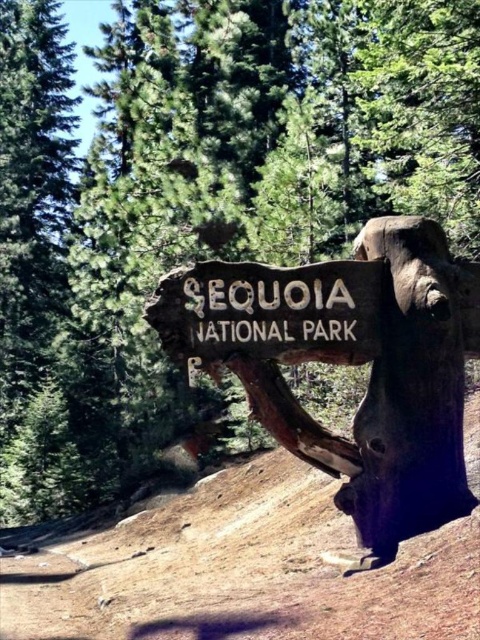
Question: Which object is farther from the camera taking this photo?

Choices:
 (A) weathered wood sign at center
 (B) brown dirt track at lower left

Answer: (A)

Question: Which point appears farthest from the camera in this image?

Choices:
 (A) (60, 620)
 (B) (276, 268)

Answer: (A)

Question: Can you confirm if brown dirt track at lower left is smaller than weathered wood sign at center?

Choices:
 (A) no
 (B) yes

Answer: (A)

Question: Can you confirm if brown dirt track at lower left is bigger than weathered wood sign at center?

Choices:
 (A) no
 (B) yes

Answer: (B)

Question: Does brown dirt track at lower left appear under weathered wood sign at center?

Choices:
 (A) no
 (B) yes

Answer: (B)